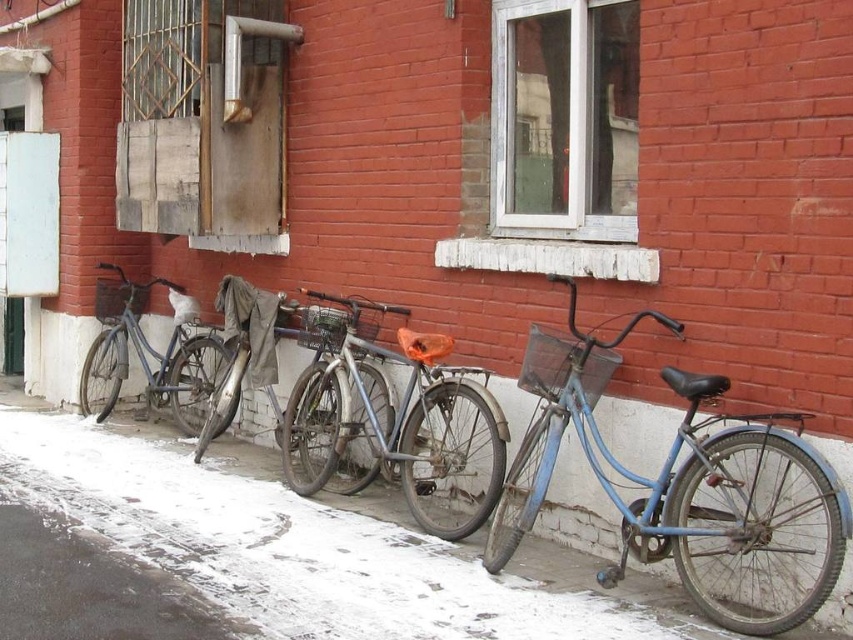
You are a delivery person who needs to choose between the blue matte bicycle at center and the shiny metallic bicycle at center for a delivery job that requires carrying heavy packages. Which bicycle would be more suitable based on their heights?

The blue matte bicycle at center is taller than the shiny metallic bicycle at center, making it more suitable for carrying heavy packages as taller bicycles typically have a higher load capacity.

You are standing in a snowy area and see the white snow at lower left and the shiny metallic bicycle at center. Which object is closer to you?

The white snow at lower left is closer to you because it is in front of the shiny metallic bicycle at center.

You are a delivery person who needs to take a bicycle from the row. You see the blue matte bicycle at center and the shiny metallic bicycle at center. Which one is closer to you?

The blue matte bicycle at center is closer to you because it is in front of the shiny metallic bicycle at center.